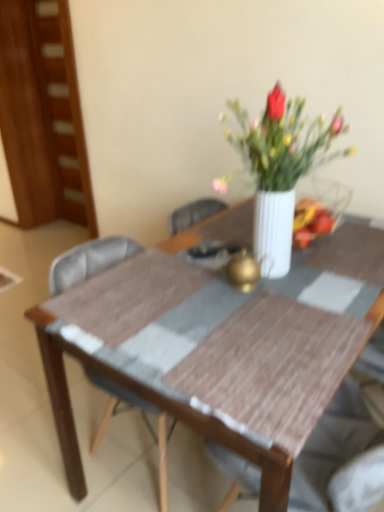
Where is `vacant point above wooden table at center (from a real-world perspective)`? vacant point above wooden table at center (from a real-world perspective) is located at coordinates (229, 285).